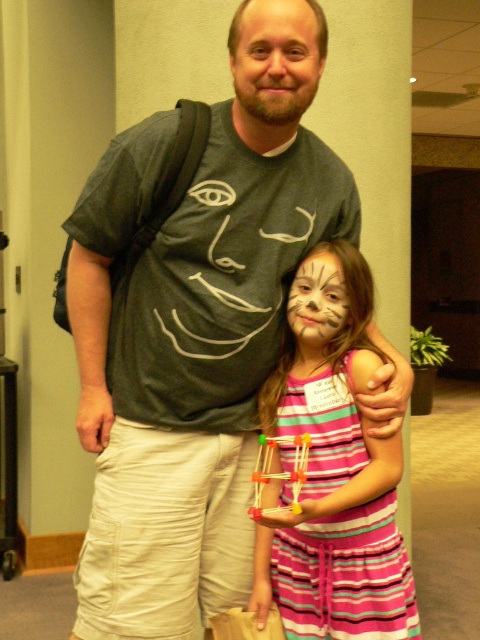
Question: Which of the following is the farthest from the observer?

Choices:
 (A) (162, 611)
 (B) (303, 307)

Answer: (B)

Question: Based on their relative distances, which object is farther from the striped cotton dress at center?

Choices:
 (A) matte gray t-shirt at center
 (B) white matte face paint at center
 (C) matte gray face at center

Answer: (C)

Question: Does matte gray t-shirt at center have a lesser width compared to matte gray face at center?

Choices:
 (A) no
 (B) yes

Answer: (A)

Question: Based on their relative distances, which object is nearer to the white matte face paint at center?

Choices:
 (A) matte gray face at center
 (B) striped cotton dress at center
 (C) matte gray t-shirt at center

Answer: (B)

Question: Can you confirm if striped cotton dress at center is smaller than white matte face paint at center?

Choices:
 (A) yes
 (B) no

Answer: (B)

Question: Considering the relative positions of matte gray t-shirt at center and white matte face paint at center in the image provided, where is matte gray t-shirt at center located with respect to white matte face paint at center?

Choices:
 (A) left
 (B) right

Answer: (A)